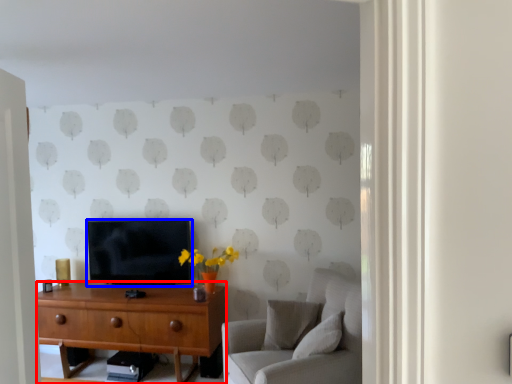
Question: Which point is closer to the camera, desk (highlighted by a red box) or television (highlighted by a blue box)?

Choices:
 (A) desk
 (B) television

Answer: (A)